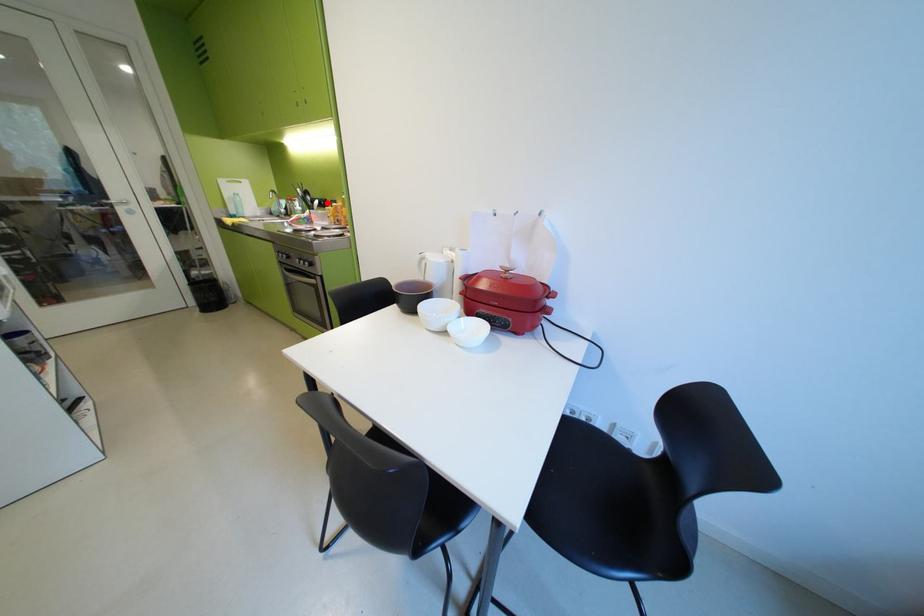
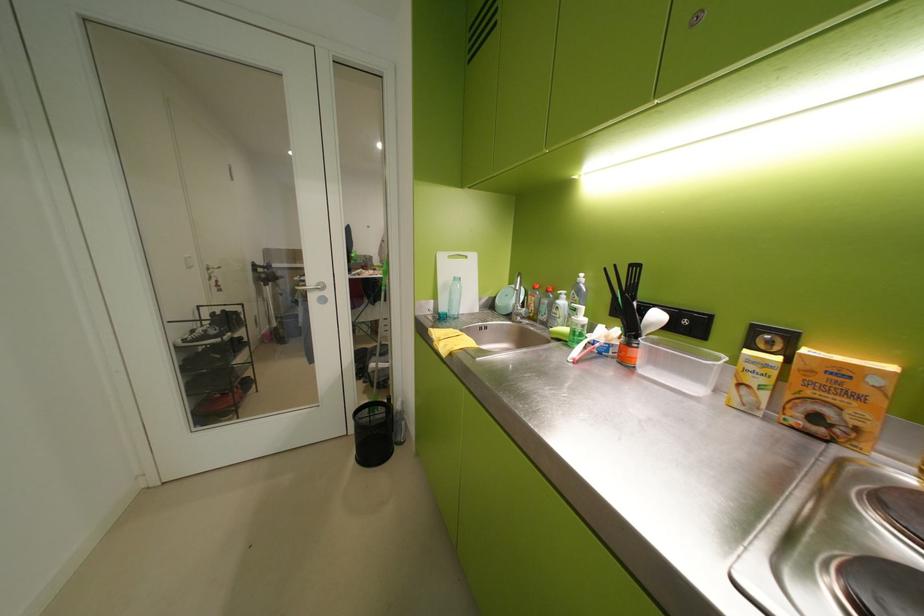
The point at the highlighted location is marked in the first image. Where is the corresponding point in the second image?

(667, 317)